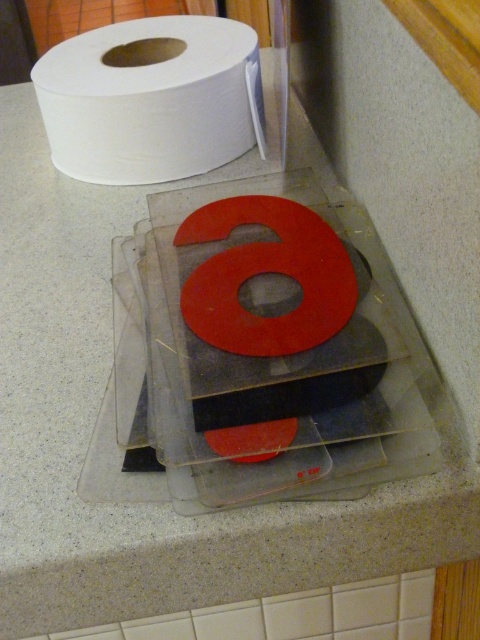
Question: Is white matte paper towel at upper left positioned behind matte red letter at center?

Choices:
 (A) yes
 (B) no

Answer: (A)

Question: Which of the following is the farthest from the observer?

Choices:
 (A) (215, 314)
 (B) (66, 129)

Answer: (B)

Question: Considering the relative positions of white matte paper towel at upper left and matte red letter at center in the image provided, where is white matte paper towel at upper left located with respect to matte red letter at center?

Choices:
 (A) below
 (B) above

Answer: (B)

Question: Does white matte paper towel at upper left come behind matte red letter at center?

Choices:
 (A) yes
 (B) no

Answer: (A)

Question: Which point is farther to the camera?

Choices:
 (A) white matte paper towel at upper left
 (B) matte red letter at center

Answer: (A)